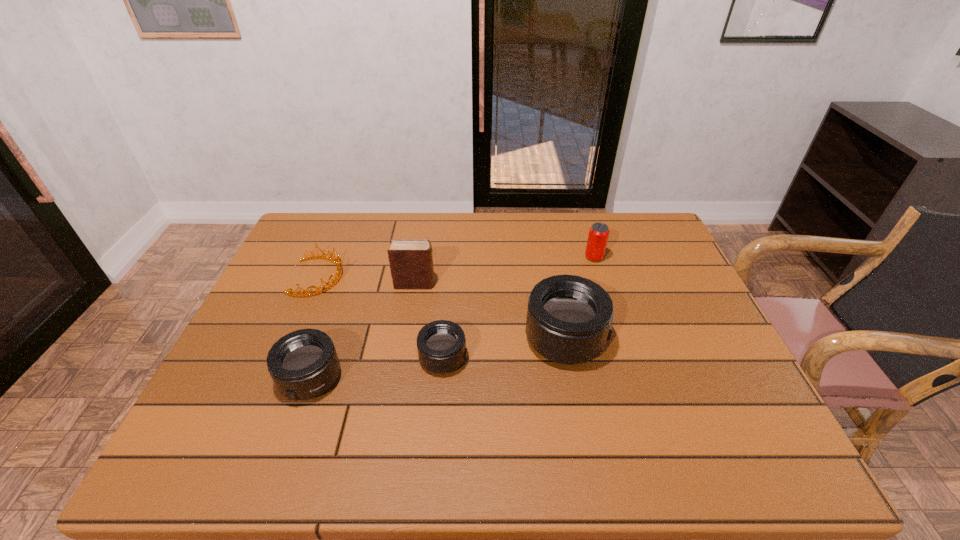
You are a GUI agent. You are given a task and a screenshot of the screen. Output one action in this format:
    pyautogui.click(x=<x>, y=<y>)
    Task: Click on the free space located 0.110m on the side of the rightmost telephoto lens with brand markings and control switches
    
    Given the screenshot: What is the action you would take?
    pyautogui.click(x=649, y=339)

The height and width of the screenshot is (540, 960). Find the location of `vacant space located 0.360m on the front-facing side of the tiara`. vacant space located 0.360m on the front-facing side of the tiara is located at coordinates (465, 276).

Where is `free region located on the right of the can`? free region located on the right of the can is located at coordinates (670, 258).

You are a GUI agent. You are given a task and a screenshot of the screen. Output one action in this format:
    pyautogui.click(x=<x>, y=<y>)
    Task: Click on the vacant space situated on the spine side of the diary
    The height and width of the screenshot is (540, 960).
    Given the screenshot: What is the action you would take?
    pyautogui.click(x=572, y=284)

Image resolution: width=960 pixels, height=540 pixels. Find the location of `object situated at the far edge`. object situated at the far edge is located at coordinates (598, 235).

At what (x,y) coordinates should I click in order to perform the action: click on object that is at the near edge. Please return your answer as a coordinate pair (x, y). Image resolution: width=960 pixels, height=540 pixels. Looking at the image, I should click on (303, 364).

At what (x,y) coordinates should I click in order to perform the action: click on telephoto lens that is at the left edge. Please return your answer as a coordinate pair (x, y). Looking at the image, I should click on (303, 364).

You are a GUI agent. You are given a task and a screenshot of the screen. Output one action in this format:
    pyautogui.click(x=<x>, y=<y>)
    Task: Click on the tiara positioned at the left edge
    The height and width of the screenshot is (540, 960).
    Given the screenshot: What is the action you would take?
    pyautogui.click(x=338, y=274)

What are the coordinates of `object at the near left corner` in the screenshot? It's located at (303, 364).

The width and height of the screenshot is (960, 540). In the image, there is a desktop. Find the location of `vacant space at the far edge`. vacant space at the far edge is located at coordinates (558, 225).